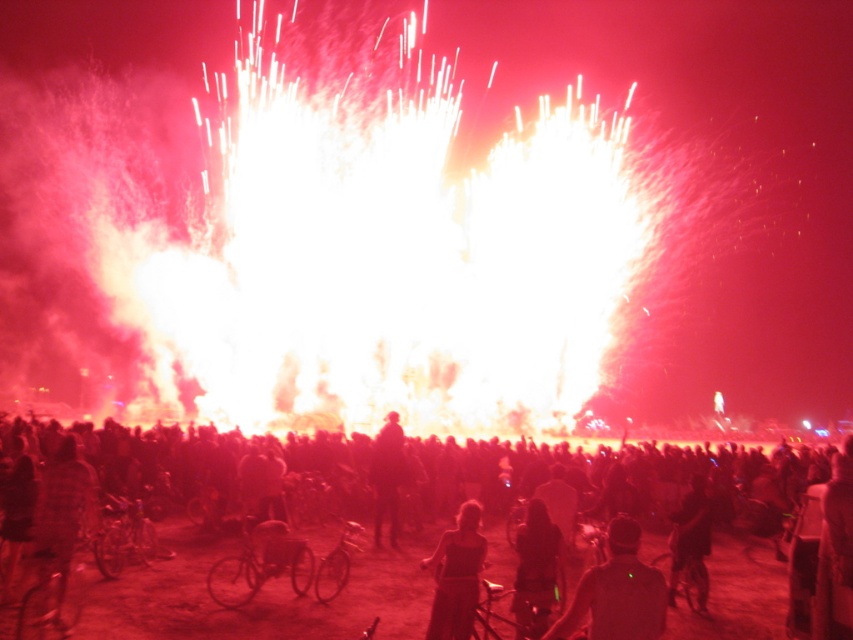
You are a photographer trying to capture the fireworks display. You notice two elements in the center of your frame, the dark hair at center and the matte black dress at center. Which one should you adjust your focus on to ensure it appears larger in the photo?

The dark hair at center is bigger than the matte black dress at center, so you should focus on the dark hair at center to ensure it appears larger in the photo.

You are at a fireworks event and want to quickly move through the crowd. You see a silhouette fabric person at center and a dark matte bicycle at center. Which object can you pass through more easily?

The silhouette fabric person at center is thinner than the dark matte bicycle at center, so you can pass through the silhouette fabric person at center more easily.